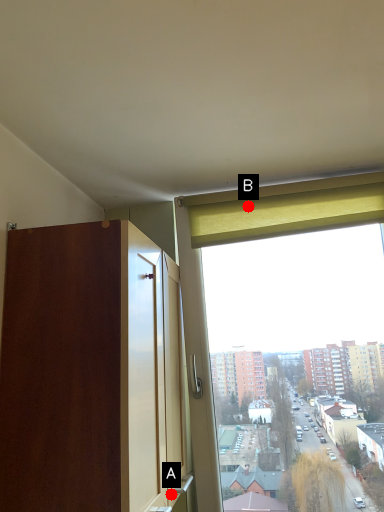
Question: Two points are circled on the image, labeled by A and B beside each circle. Which point is closer to the camera?

Choices:
 (A) A is closer
 (B) B is closer

Answer: (A)